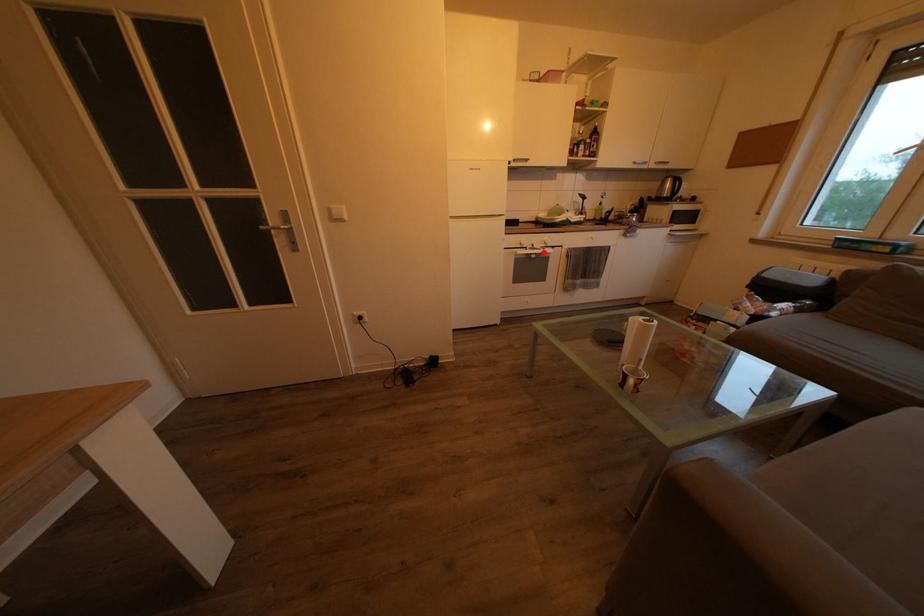
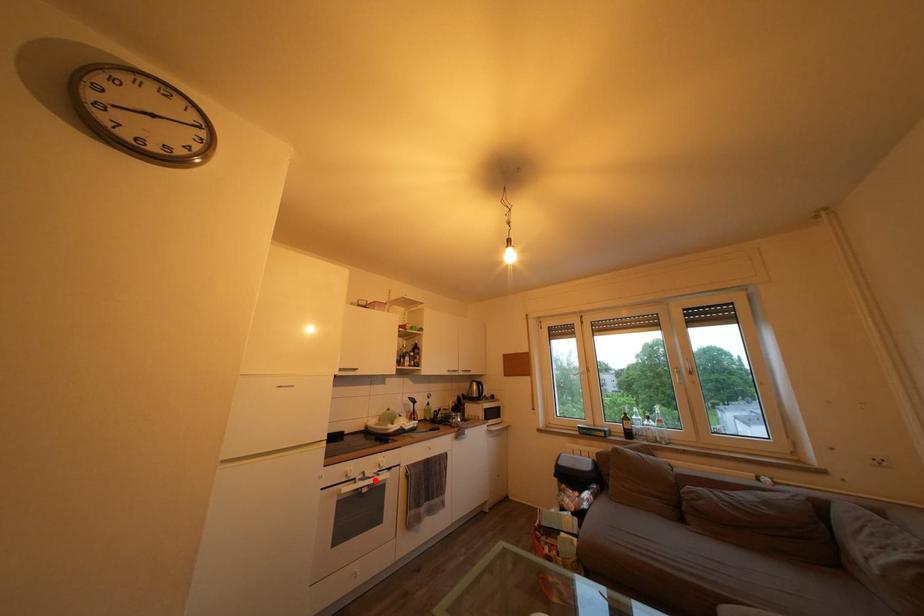
I am providing you with two images of the same scene from different viewpoints. A red point is marked on the first image and another point is marked on the second image. Do the highlighted points in image1 and image2 indicate the same real-world spot?

Yes